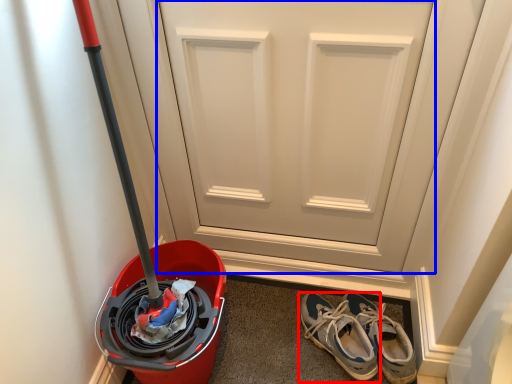
Question: Which object is closer to the camera taking this photo, footwear (highlighted by a red box) or door (highlighted by a blue box)?

Choices:
 (A) footwear
 (B) door

Answer: (B)